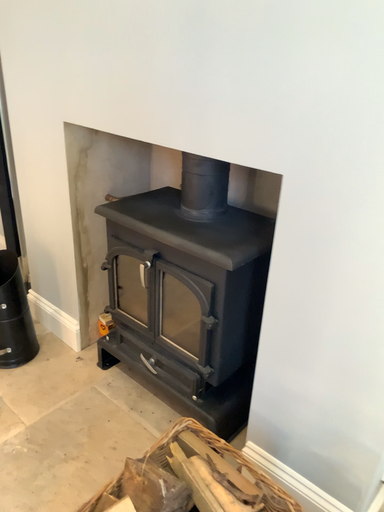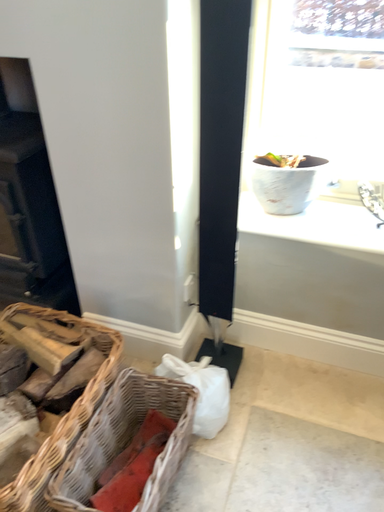
Question: How did the camera likely rotate when shooting the video?

Choices:
 (A) rotated left
 (B) rotated right

Answer: (B)